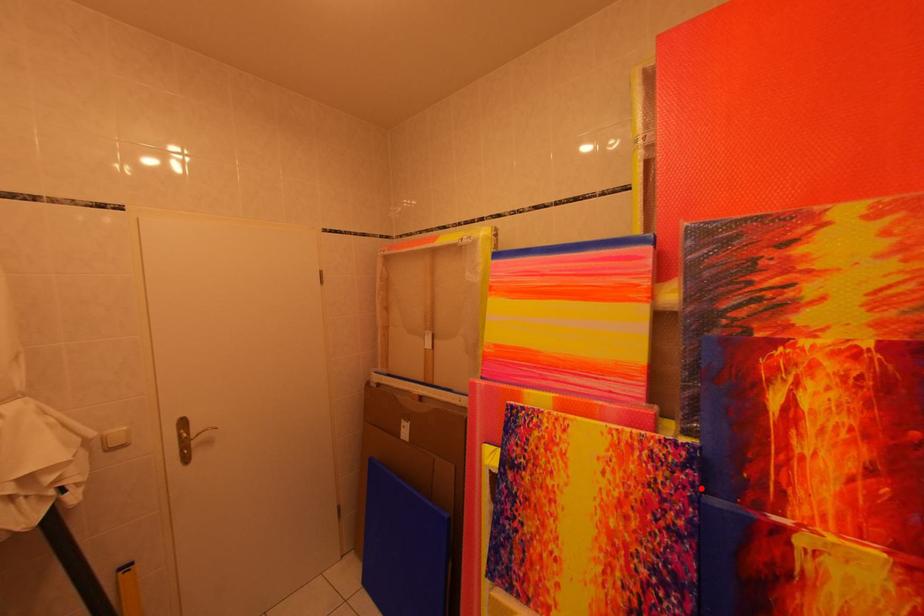
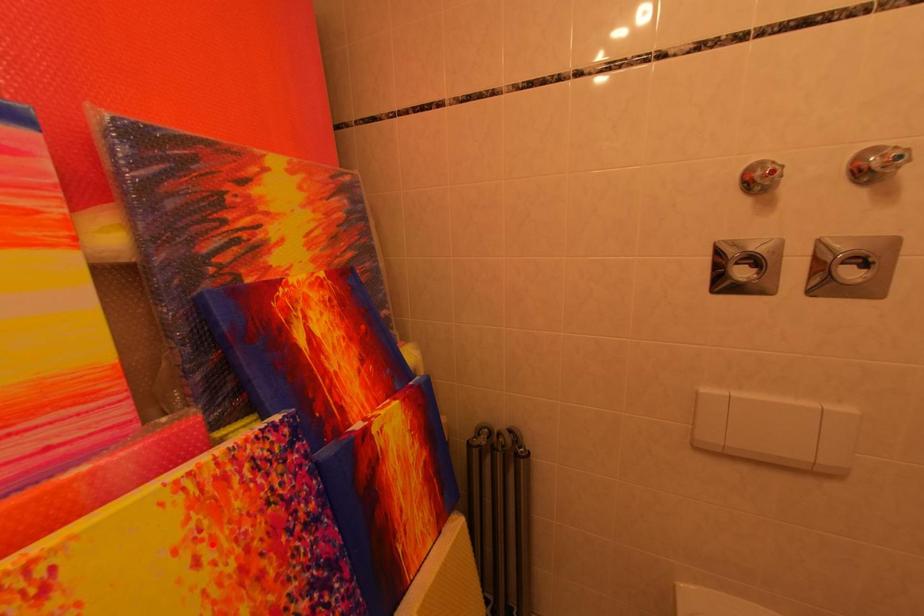
I am providing you with two images of the same scene from different viewpoints. A red point is marked on the first image and another point is marked on the second image. Is the red point in image1 aligned with the point shown in image2?

No